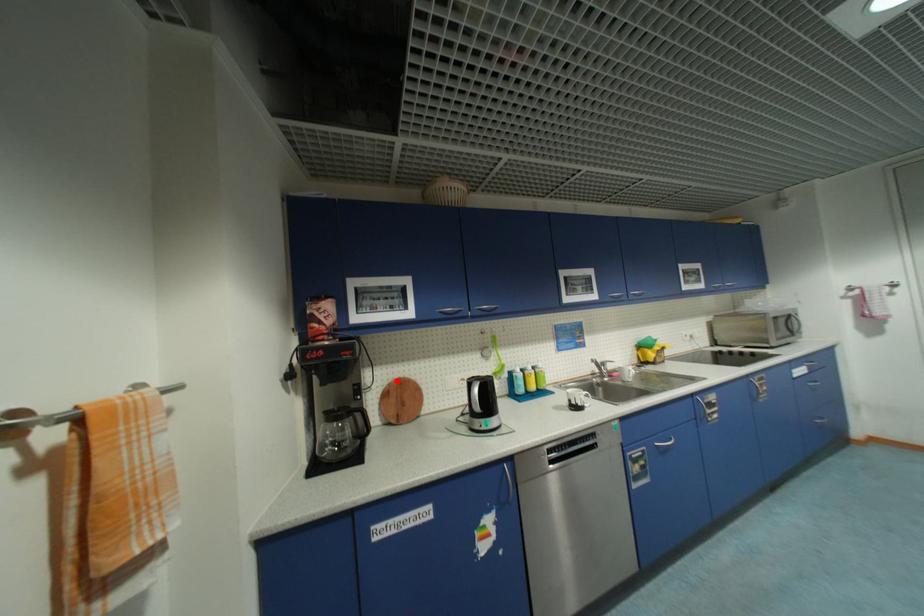
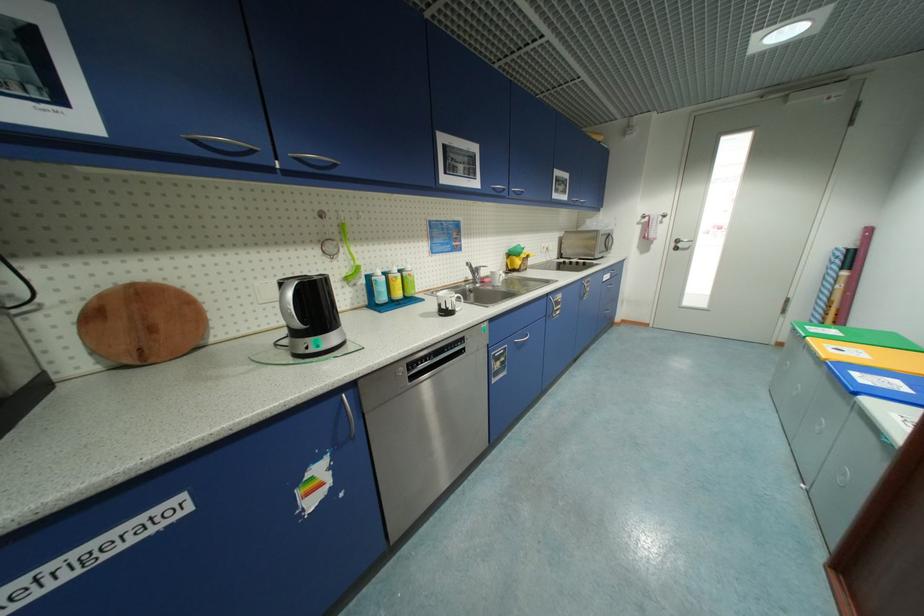
Question: I am providing you with two images of the same scene from different viewpoints. A red point is marked on the first image. Can you still see the location of the red point in image 2?

Choices:
 (A) Yes
 (B) No

Answer: (A)